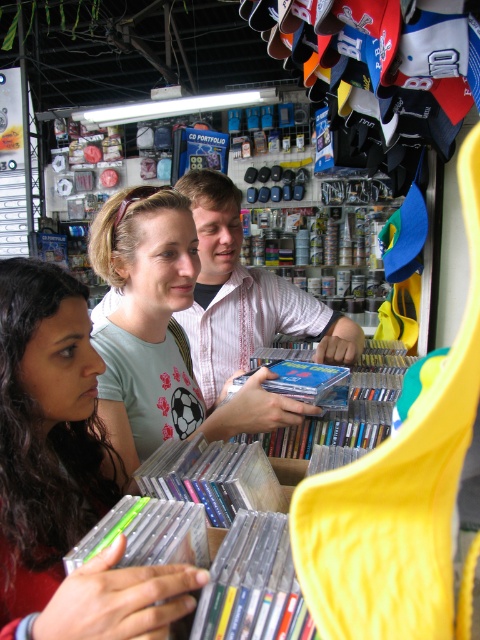
You are a customer in the shop and want to reach the matte green cd case at center. The white printed shirt at center is in your way. Can you easily reach the cd case without moving the shirt?

The matte green cd case at center is shorter than the white printed shirt at center, so it might be partially obscured. You may need to move the shirt to access the cd case.

You are standing in the shop and want to pick up an item located at the point with coordinates point (173, 282). If your arm can reach 1 meter, can you reach it without moving your feet?

The point (173, 282) is 1.13 meters away from you, so you cannot reach it with an arm length of 1 meter without moving your feet.